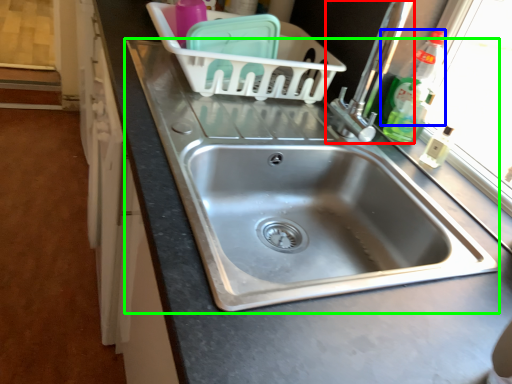
Question: Based on their relative distances, which object is farther from tap (highlighted by a red box)? Choose from bottle (highlighted by a blue box) and sink (highlighted by a green box).

Choices:
 (A) bottle
 (B) sink

Answer: (B)